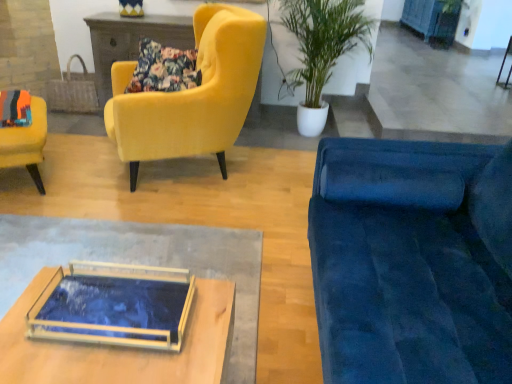
Question: From a real-world perspective, is velvet yellow armchair at upper left, arranged as the first chair when viewed from the right, physically located above or below blue painted wood cabinet at upper right?

Choices:
 (A) above
 (B) below

Answer: (B)

Question: In terms of height, does velvet yellow armchair at upper left, arranged as the first chair when viewed from the right, look taller or shorter compared to blue painted wood cabinet at upper right?

Choices:
 (A) tall
 (B) short

Answer: (A)

Question: Considering the real-world distances, which object is closest to the green leafy plant in white pot at upper center?

Choices:
 (A) blue painted wood cabinet at upper right
 (B) velvet blue couch at right
 (C) velvet yellow armchair at left, which appears as the 2th chair when viewed from the right
 (D) velvet yellow armchair at upper left, the second chair positioned from the left
 (E) floral fabric pillow at upper left

Answer: (D)

Question: Considering the real-world distances, which object is closest to the yellow and blue striped vase at upper center?

Choices:
 (A) translucent glass tray at center
 (B) velvet yellow armchair at left, which is the 1th chair in left-to-right order
 (C) blue painted wood cabinet at upper right
 (D) velvet blue couch at right
 (E) woven straw handbag at upper left

Answer: (E)